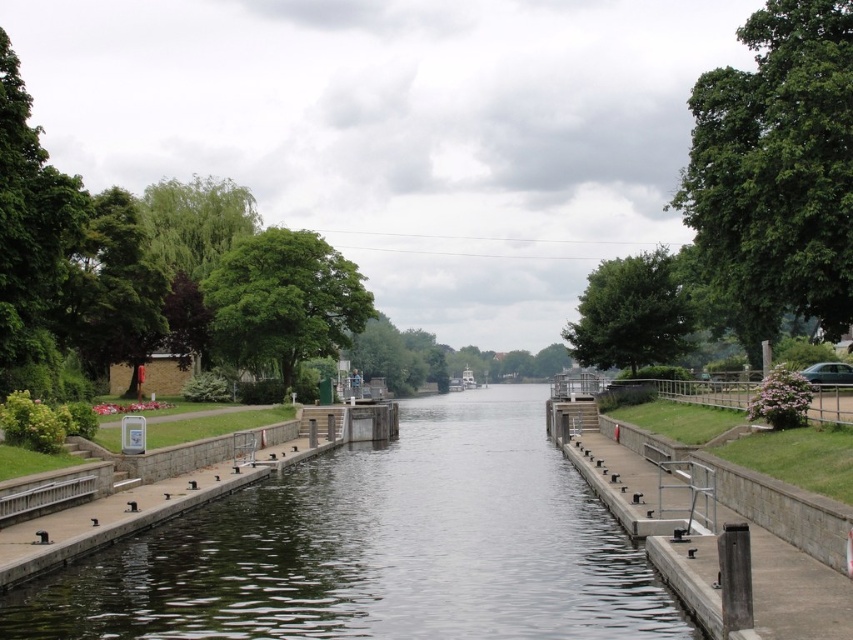
Question: Which object is closer to the camera taking this photo?

Choices:
 (A) green leafy tree at upper center
 (B) dark green water at center
 (C) green leafy tree at upper right
 (D) green leafy tree at center

Answer: (B)

Question: Does dark green water at center have a larger size compared to green leafy tree at upper right?

Choices:
 (A) no
 (B) yes

Answer: (A)

Question: Estimate the real-world distances between objects in this image. Which object is closer to the green leafy tree at upper center?

Choices:
 (A) dark green water at center
 (B) green leafy tree at center

Answer: (B)

Question: Does green leafy tree at upper right have a greater width compared to green leafy tree at center?

Choices:
 (A) no
 (B) yes

Answer: (B)

Question: Is green leafy tree at upper right bigger than green leafy tree at upper center?

Choices:
 (A) yes
 (B) no

Answer: (A)

Question: Which object appears closest to the camera in this image?

Choices:
 (A) green leafy tree at upper center
 (B) dark green water at center
 (C) green leafy tree at center
 (D) green leafy tree at upper right

Answer: (B)